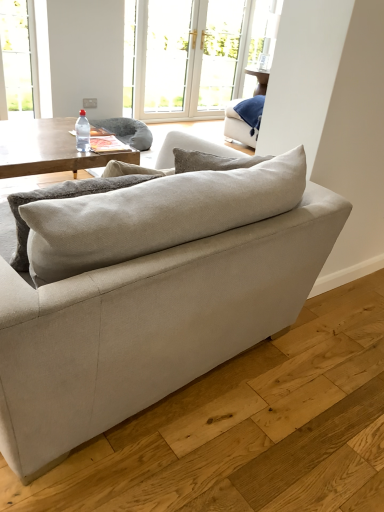
Question: Is white glossy window at upper center smaller than white glass door at upper center?

Choices:
 (A) no
 (B) yes

Answer: (B)

Question: Is white glass door at upper center located within white glossy window at upper center?

Choices:
 (A) no
 (B) yes

Answer: (B)

Question: From the image's perspective, is white glossy window at upper center located beneath white glass door at upper center?

Choices:
 (A) yes
 (B) no

Answer: (A)

Question: From a real-world perspective, is white glossy window at upper center located higher than white glass door at upper center?

Choices:
 (A) yes
 (B) no

Answer: (B)

Question: Considering the relative sizes of white glossy window at upper center and white glass door at upper center in the image provided, is white glossy window at upper center taller than white glass door at upper center?

Choices:
 (A) yes
 (B) no

Answer: (B)

Question: Considering the relative positions of white glossy window at upper center and transparent plastic bottle at center in the image provided, is white glossy window at upper center to the left or to the right of transparent plastic bottle at center?

Choices:
 (A) right
 (B) left

Answer: (A)

Question: Considering the positions of white glossy window at upper center and transparent plastic bottle at center in the image, is white glossy window at upper center bigger or smaller than transparent plastic bottle at center?

Choices:
 (A) small
 (B) big

Answer: (B)

Question: Do you think white glossy window at upper center is within transparent plastic bottle at center, or outside of it?

Choices:
 (A) inside
 (B) outside

Answer: (B)

Question: In the image, is white glossy window at upper center positioned in front of or behind transparent plastic bottle at center?

Choices:
 (A) front
 (B) behind

Answer: (B)

Question: Considering the positions of clear glass screen door at upper center and transparent plastic bottle at center in the image, is clear glass screen door at upper center taller or shorter than transparent plastic bottle at center?

Choices:
 (A) tall
 (B) short

Answer: (A)

Question: From a real-world perspective, is clear glass screen door at upper center above or below transparent plastic bottle at center?

Choices:
 (A) below
 (B) above

Answer: (B)

Question: Would you say clear glass screen door at upper center is to the left or to the right of transparent plastic bottle at center in the picture?

Choices:
 (A) right
 (B) left

Answer: (A)

Question: Looking at the image, does clear glass screen door at upper center seem bigger or smaller compared to transparent plastic bottle at center?

Choices:
 (A) small
 (B) big

Answer: (B)

Question: Relative to woodenwoodencoffee table at left, is beige fabric couch at center in front or behind?

Choices:
 (A) behind
 (B) front

Answer: (B)

Question: From a real-world perspective, is beige fabric couch at center above or below woodenwoodencoffee table at left?

Choices:
 (A) below
 (B) above

Answer: (B)